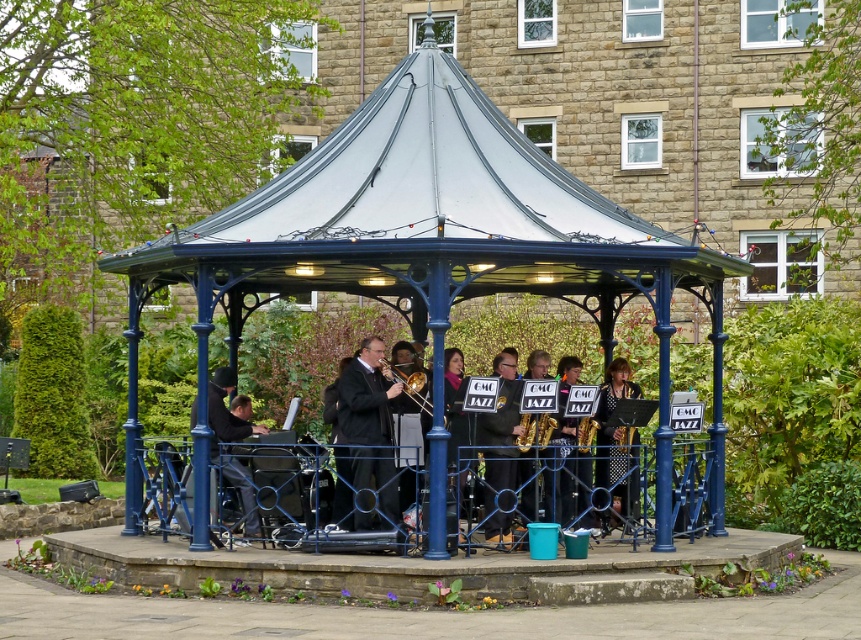
You are a photographer wanting to capture the gold metallic saxophone at center without any obstructions. Based on the scene, is the metallic blue gazebo at center blocking the saxophone from view? Please explain.

The metallic blue gazebo at center is positioned over the gold metallic saxophone at center, so it would block the saxophone from view. To capture an unobstructed image, you would need to adjust your angle or position to avoid the gazebo.

You are a photographer standing at the camera position. You want to capture a closeup of the satin gold saxophone at center. Given that your camera has a maximum zoom range of 20 meters, can you achieve this?

The satin gold saxophone at center and camera are 22.02 meters apart, which exceeds the camera maximum zoom range of 20 meters. Therefore, you cannot achieve a closeup of the satin gold saxophone at center with the current camera settings.